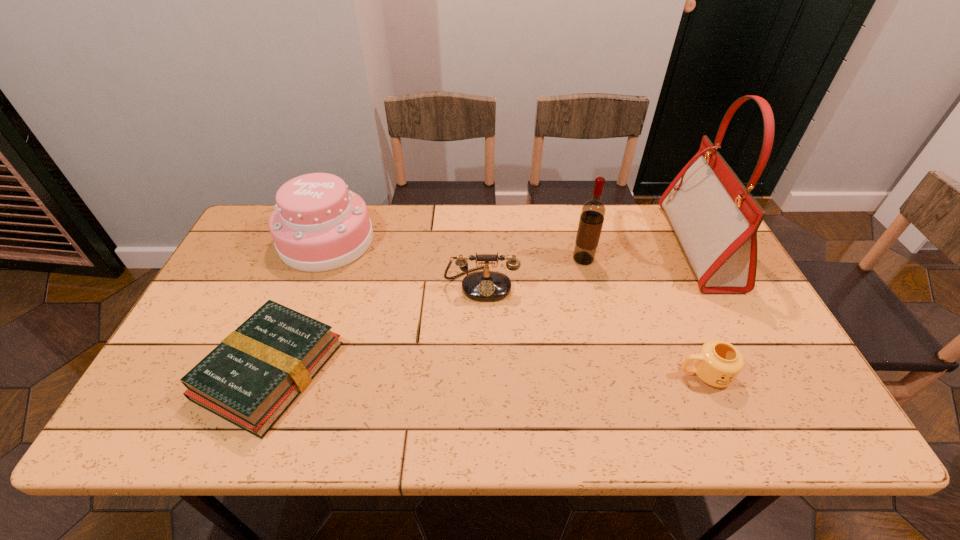
The width and height of the screenshot is (960, 540). In the image, there is a desktop. Identify the location of vacant space at the left edge. [x=180, y=397].

Locate an element on the screen. Image resolution: width=960 pixels, height=540 pixels. blank space at the far left corner is located at coordinates (266, 207).

The width and height of the screenshot is (960, 540). Identify the location of empty space that is in between the fourth object from right to left and the wine bottle. (533, 272).

Locate an element on the screen. The width and height of the screenshot is (960, 540). empty location between the fifth shortest object and the third object from left to right is located at coordinates (533, 272).

Where is `free spot between the third object from right to left and the rightmost object`? The image size is (960, 540). free spot between the third object from right to left and the rightmost object is located at coordinates (641, 253).

Where is `vacant area that lies between the tallest object and the wine bottle`? vacant area that lies between the tallest object and the wine bottle is located at coordinates (641, 253).

Image resolution: width=960 pixels, height=540 pixels. I want to click on free point between the wine bottle and the fourth object from right to left, so click(x=533, y=272).

You are a GUI agent. You are given a task and a screenshot of the screen. Output one action in this format:
    pyautogui.click(x=<x>, y=<y>)
    Task: Click on the unoccupied position between the shortest object and the wine bottle
    
    Given the screenshot: What is the action you would take?
    pyautogui.click(x=426, y=314)

In order to click on vacant area between the fourth object from left to right and the fifth tallest object in this screenshot , I will do `click(644, 316)`.

This screenshot has width=960, height=540. Find the location of `unoccupied area between the third object from left to right and the fifth object from left to right`. unoccupied area between the third object from left to right and the fifth object from left to right is located at coordinates (593, 329).